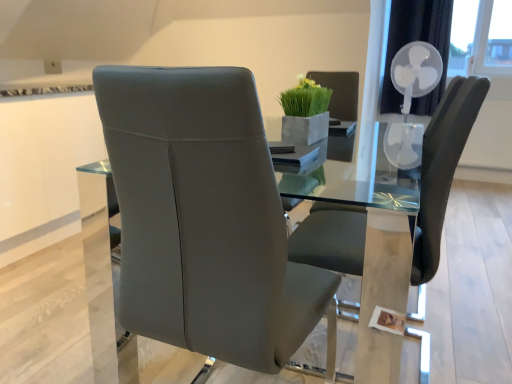
Question: Can you confirm if satin grey leather chair at center, the first chair from the left, is bigger than white plastic fan at upper right?

Choices:
 (A) yes
 (B) no

Answer: (B)

Question: Can you confirm if satin grey leather chair at center, which is counted as the 2th chair, starting from the right, is shorter than white plastic fan at upper right?

Choices:
 (A) no
 (B) yes

Answer: (B)

Question: From the image's perspective, would you say satin grey leather chair at center, which is counted as the 2th chair, starting from the right, is positioned over white plastic fan at upper right?

Choices:
 (A) yes
 (B) no

Answer: (B)

Question: From a real-world perspective, is satin grey leather chair at center, which is counted as the 2th chair, starting from the right, below white plastic fan at upper right?

Choices:
 (A) no
 (B) yes

Answer: (B)

Question: Is satin grey leather chair at center, which is counted as the 2th chair, starting from the right, behind white plastic fan at upper right?

Choices:
 (A) yes
 (B) no

Answer: (B)

Question: From a real-world perspective, relative to matte gray chair at center, marked as the 1th chair in a right-to-left arrangement, is satin grey leather chair at center, which is counted as the 2th chair, starting from the right, vertically above or below?

Choices:
 (A) below
 (B) above

Answer: (B)

Question: Based on their positions, is satin grey leather chair at center, which is counted as the 2th chair, starting from the right, located to the left or right of matte gray chair at center, marked as the 1th chair in a right-to-left arrangement?

Choices:
 (A) left
 (B) right

Answer: (A)

Question: Considering the positions of point (189, 182) and point (473, 96), is point (189, 182) closer or farther from the camera than point (473, 96)?

Choices:
 (A) farther
 (B) closer

Answer: (B)

Question: From the image's perspective, is satin grey leather chair at center, the first chair from the left, positioned above or below matte gray chair at center, the 2th chair positioned from the left?

Choices:
 (A) below
 (B) above

Answer: (A)

Question: In terms of size, does satin grey leather chair at center, the first chair from the left, appear bigger or smaller than green matte vase at upper center?

Choices:
 (A) big
 (B) small

Answer: (A)

Question: From a real-world perspective, relative to green matte vase at upper center, is satin grey leather chair at center, which is counted as the 2th chair, starting from the right, vertically above or below?

Choices:
 (A) above
 (B) below

Answer: (B)

Question: Is satin grey leather chair at center, which is counted as the 2th chair, starting from the right, spatially inside green matte vase at upper center, or outside of it?

Choices:
 (A) outside
 (B) inside

Answer: (A)

Question: Is point (262, 286) positioned closer to the camera than point (327, 97)?

Choices:
 (A) farther
 (B) closer

Answer: (B)

Question: From the image's perspective, is green matte vase at upper center above or below white plastic fan at upper right?

Choices:
 (A) below
 (B) above

Answer: (A)

Question: Is green matte vase at upper center to the left or to the right of white plastic fan at upper right in the image?

Choices:
 (A) right
 (B) left

Answer: (B)